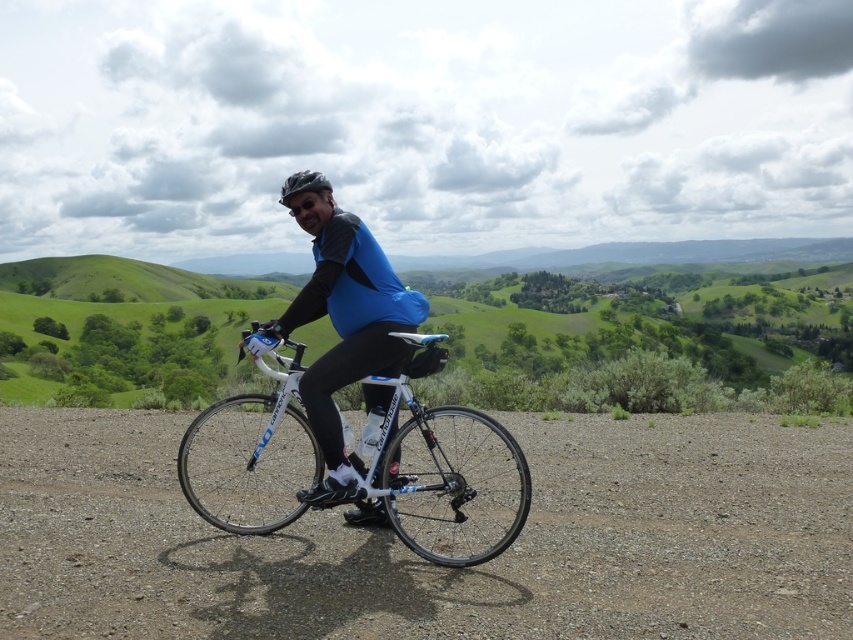
Question: From the image, what is the correct spatial relationship of gray gravel dirt track at center in relation to white glossy bicycle at center?

Choices:
 (A) below
 (B) above

Answer: (A)

Question: Which point is closer to the camera taking this photo?

Choices:
 (A) (422, 339)
 (B) (596, 308)
 (C) (288, 192)

Answer: (A)

Question: Is gray gravel dirt track at center behind blue fabric shirt at center?

Choices:
 (A) yes
 (B) no

Answer: (B)

Question: Which object appears farthest from the camera in this image?

Choices:
 (A) green grassy hillside at center
 (B) matte black helmet at center

Answer: (A)

Question: Is green grassy hillside at center positioned before blue fabric shirt at center?

Choices:
 (A) yes
 (B) no

Answer: (B)

Question: Which of these objects is positioned closest to the matte black helmet at center?

Choices:
 (A) green grassy hillside at center
 (B) blue fabric shirt at center

Answer: (B)